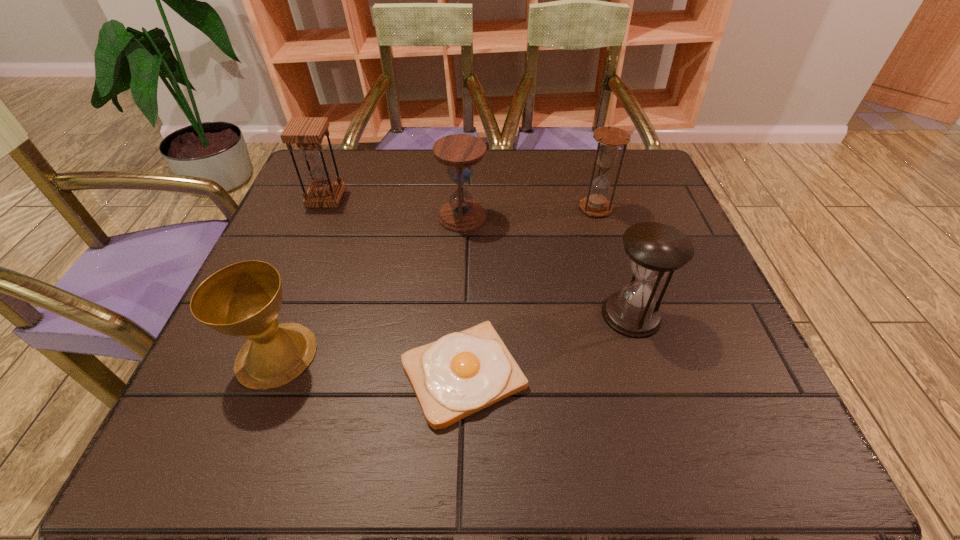
I want to click on object that is positioned at the near edge, so click(x=461, y=373).

At what (x,y) coordinates should I click in order to perform the action: click on hourglass that is at the left edge. Please return your answer as a coordinate pair (x, y). This screenshot has height=540, width=960. Looking at the image, I should click on (x=307, y=132).

Identify the location of chalice at the left edge. (244, 299).

You are a GUI agent. You are given a task and a screenshot of the screen. Output one action in this format:
    pyautogui.click(x=<x>, y=<y>)
    Task: Click on the object present at the far left corner
    
    Given the screenshot: What is the action you would take?
    pyautogui.click(x=307, y=132)

I want to click on object present at the far right corner, so click(609, 139).

In the image, there is a desktop. Identify the location of free space at the far edge. The image size is (960, 540). (371, 185).

Image resolution: width=960 pixels, height=540 pixels. In the image, there is a desktop. In order to click on vacant space at the near edge in this screenshot , I will do click(494, 452).

Identify the location of vacant region at the left edge. The height and width of the screenshot is (540, 960). (291, 213).

Where is `free space at the right edge`? The image size is (960, 540). free space at the right edge is located at coordinates (680, 296).

Where is `free space between the second hourglass from left to right and the leftmost hourglass`? free space between the second hourglass from left to right and the leftmost hourglass is located at coordinates (394, 207).